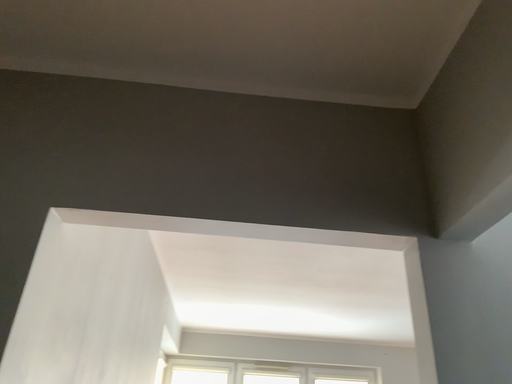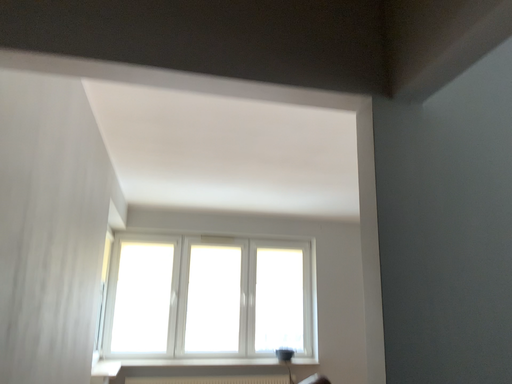
Question: Which way did the camera rotate in the video?

Choices:
 (A) rotated upward
 (B) rotated downward

Answer: (B)